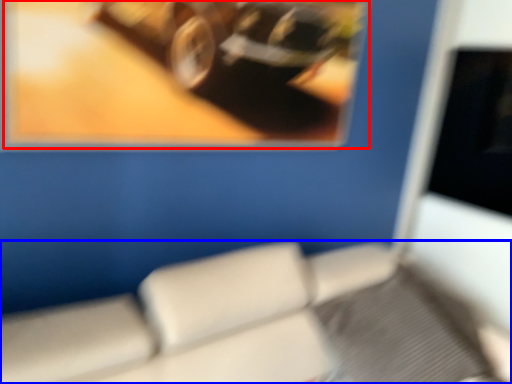
Question: Which object is further to the camera taking this photo, picture frame (highlighted by a red box) or furniture (highlighted by a blue box)?

Choices:
 (A) picture frame
 (B) furniture

Answer: (A)